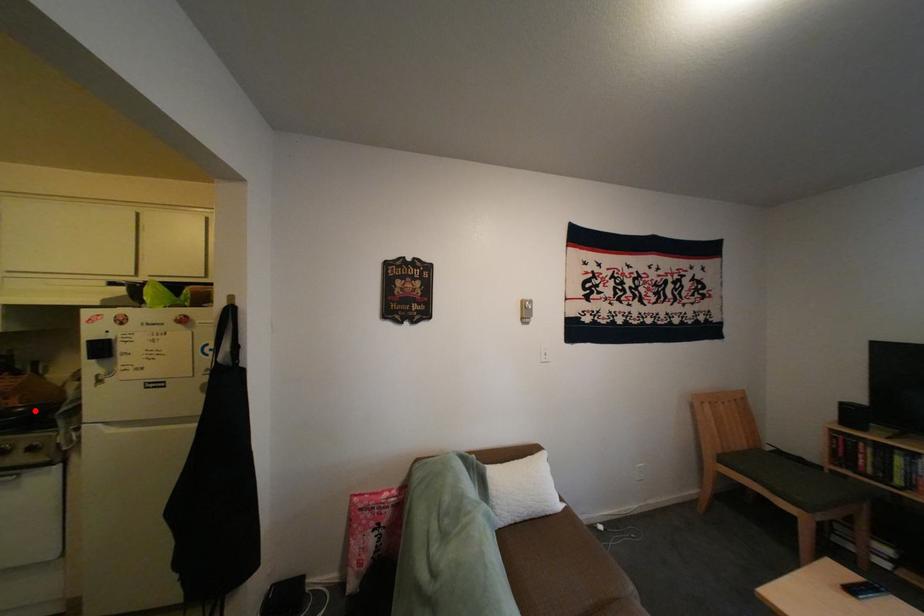
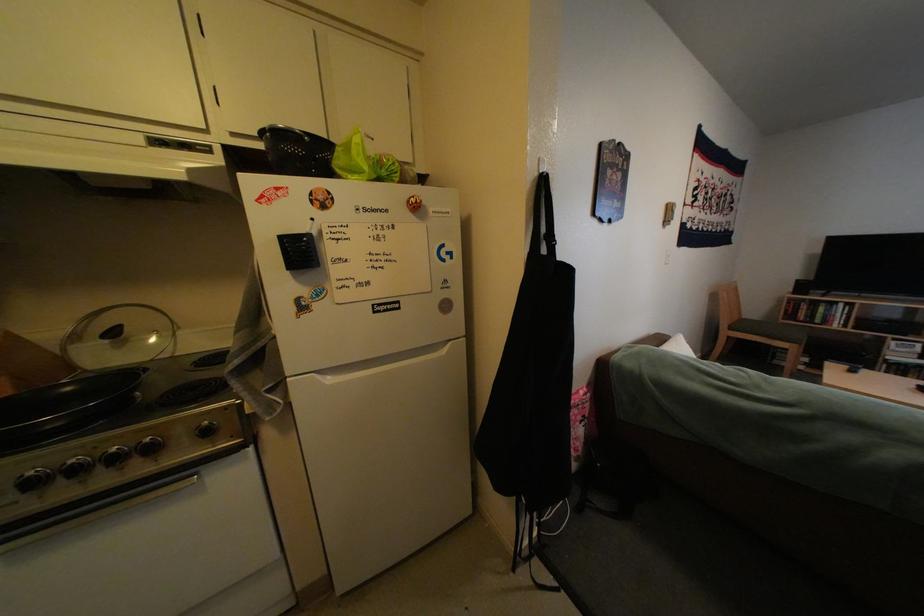
Where in the second image is the point corresponding to the highlighted location from the first image?

(80, 392)